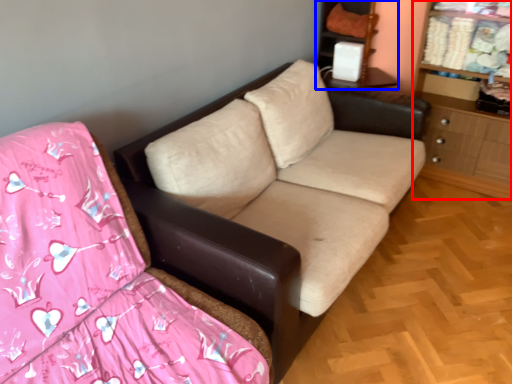
Question: Which point is closer to the camera, dresser (highlighted by a red box) or entertainment center (highlighted by a blue box)?

Choices:
 (A) dresser
 (B) entertainment center

Answer: (A)